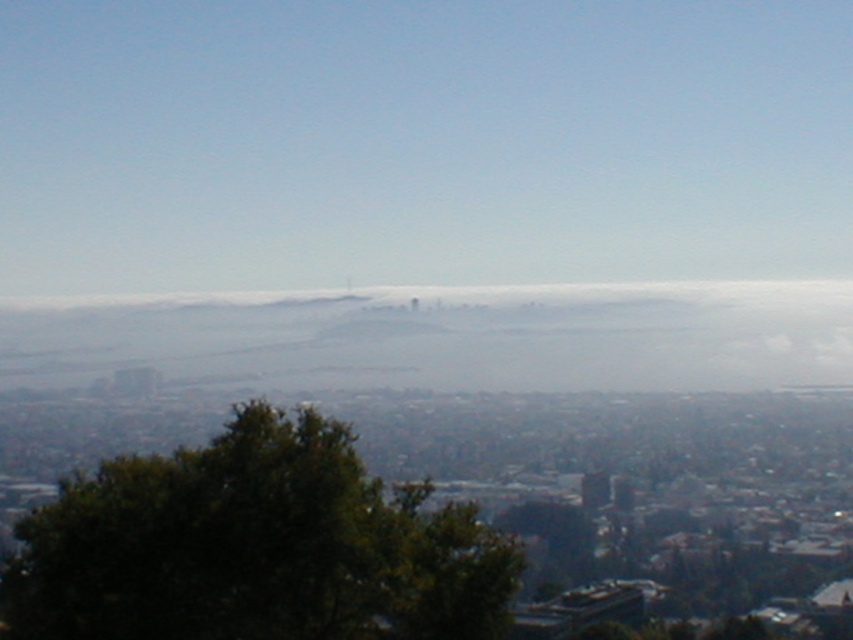
You are standing at the point labeled as point (254, 547) in the cityscape image. Looking around, you see a green leafy tree at center. Which direction should you face to see the tree?

The point labeled as point (254, 547) indicates the green leafy tree at center, so you are already facing the tree. Face forward to see it.

You are an airplane pilot preparing to land at the airport. You notice the green leafy tree at center and the foggy white cloud at center in your line of sight. Which object is closer to your plane?

The green leafy tree at center is positioned under the foggy white cloud at center, so the green leafy tree at center is closer to the plane.

You are standing at the center of the city looking towards the horizon. You notice two points marked in the image. Which point, point (403,577) or point (373,288), is closer to you?

Point (373,288) is closer to you because it is less further to the viewer than point (403,577).